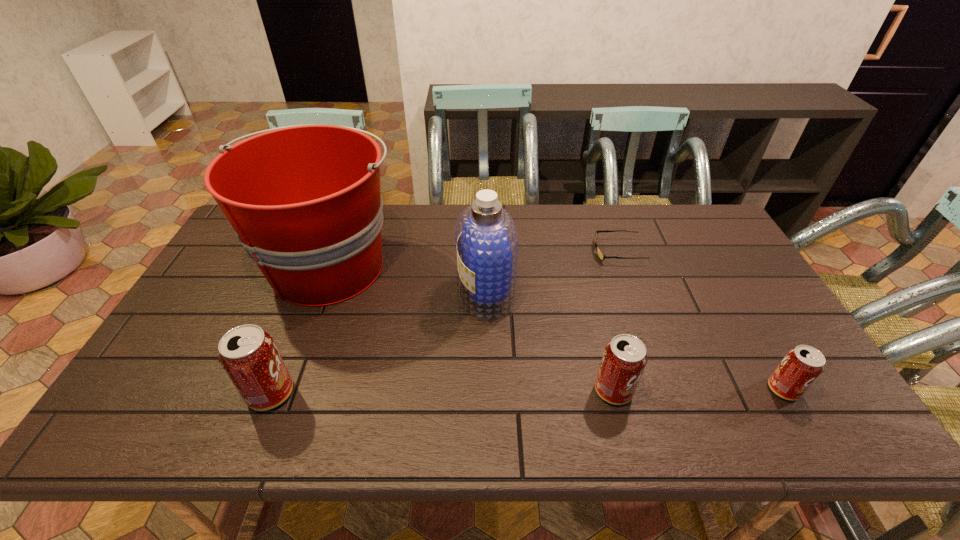
Please point a space for a new pop_(soda) to maintain equal intervals. Please provide its 2D coordinates. Your answer should be formatted as a tuple, i.e. [(x, y)], where the tuple contains the x and y coordinates of a point satisfying the conditions above.

[(443, 392)]